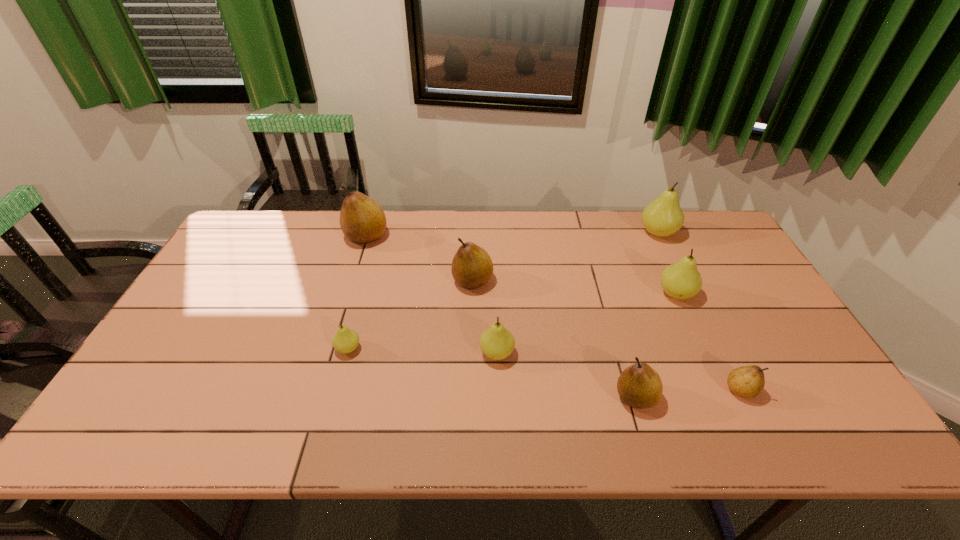
Locate which brown pear is the closest to the second brown pear from left to right. Please provide its 2D coordinates. Your answer should be formatted as a tuple, i.e. [(x, y)], where the tuple contains the x and y coordinates of a point satisfying the conditions above.

[(362, 220)]

Where is `the second closest brown pear to the fourth pear from right to left`? the second closest brown pear to the fourth pear from right to left is located at coordinates (472, 267).

You are a GUI agent. You are given a task and a screenshot of the screen. Output one action in this format:
    pyautogui.click(x=<x>, y=<y>)
    Task: Click on the green pear that can be found as the third closest to the biggest brown pear
    
    Given the screenshot: What is the action you would take?
    pyautogui.click(x=681, y=280)

I want to click on green pear that is the closest to the smallest brown pear, so click(681, 280).

This screenshot has height=540, width=960. I want to click on free space in the image that satisfies the following two spatial constraints: 1. on the front side of the smallest brown pear; 2. on the left side of the second green pear from left to right, so click(x=498, y=390).

The height and width of the screenshot is (540, 960). I want to click on vacant point that satisfies the following two spatial constraints: 1. on the back side of the leftmost green pear; 2. on the right side of the third nearest green pear, so click(x=363, y=294).